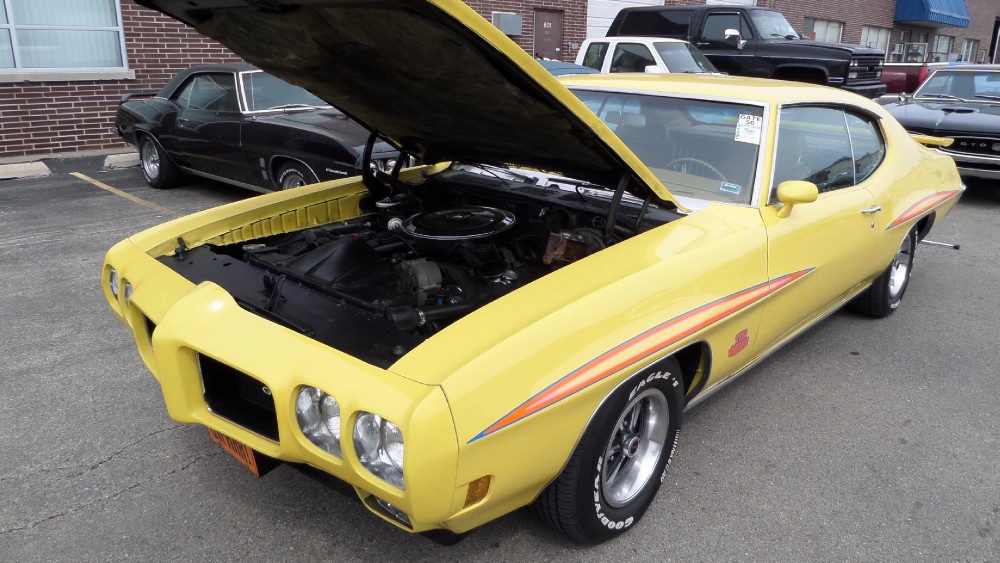
Locate an element on the screen. air filter housing is located at coordinates (478, 227).